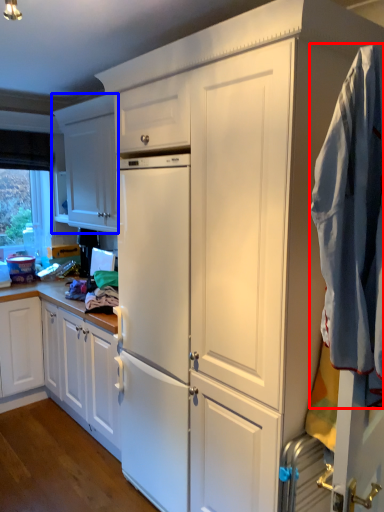
Question: Among these objects, which one is nearest to the camera, clothing (highlighted by a red box) or cabinetry (highlighted by a blue box)?

Choices:
 (A) clothing
 (B) cabinetry

Answer: (A)